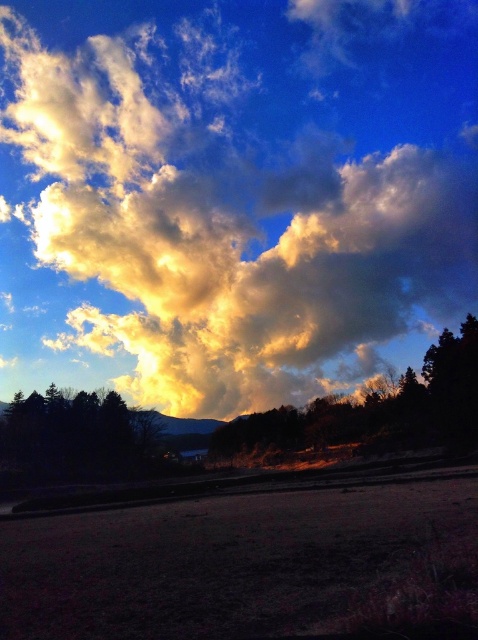
This screenshot has height=640, width=478. What do you see at coordinates (375, 412) in the screenshot? I see `smooth brown tree at center` at bounding box center [375, 412].

Measure the distance between smooth brown tree at center and dark green textured trees at lower left.

smooth brown tree at center and dark green textured trees at lower left are 35.28 meters apart.

Is point (448, 339) positioned after point (50, 406)?

No, (448, 339) is closer to viewer.

At what (x,y) coordinates should I click in order to perform the action: click on smooth brown tree at center. Please return your answer as a coordinate pair (x, y). This screenshot has width=478, height=640. Looking at the image, I should click on (375, 412).

Who is taller, cloudy sky at upper center or smooth brown tree at center?

cloudy sky at upper center

Which is more to the left, cloudy sky at upper center or smooth brown tree at center?

Positioned to the left is cloudy sky at upper center.

The image size is (478, 640). What do you see at coordinates (232, 195) in the screenshot?
I see `cloudy sky at upper center` at bounding box center [232, 195].

Locate an element on the screen. Image resolution: width=478 pixels, height=640 pixels. cloudy sky at upper center is located at coordinates [x=232, y=195].

Is cloudy sky at upper center closer to the viewer compared to dark green textured trees at lower left?

No, cloudy sky at upper center is further to the viewer.

Which is above, cloudy sky at upper center or dark green textured trees at lower left?

Positioned higher is cloudy sky at upper center.

Describe the element at coordinates (232, 195) in the screenshot. I see `cloudy sky at upper center` at that location.

In order to click on cloudy sky at upper center in this screenshot , I will do `click(232, 195)`.